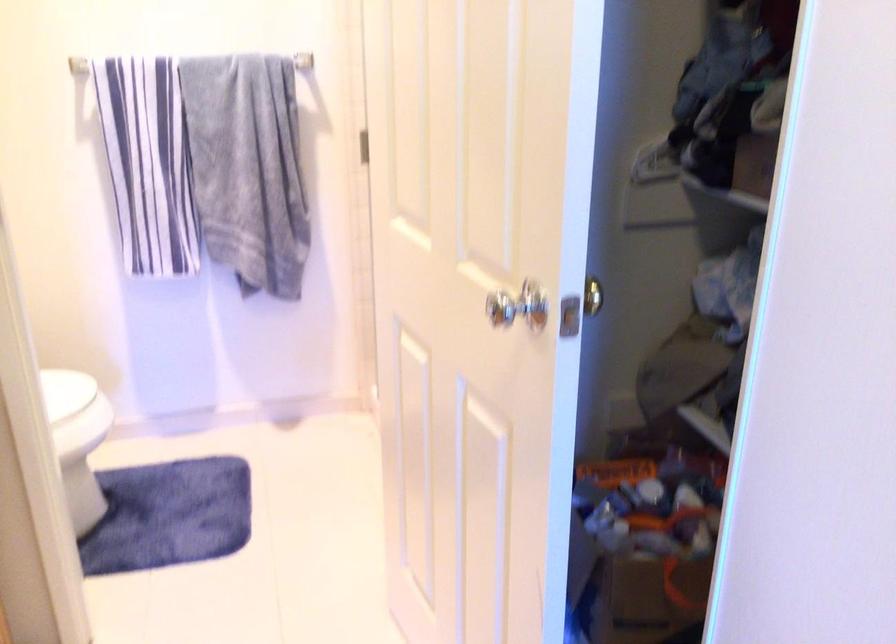
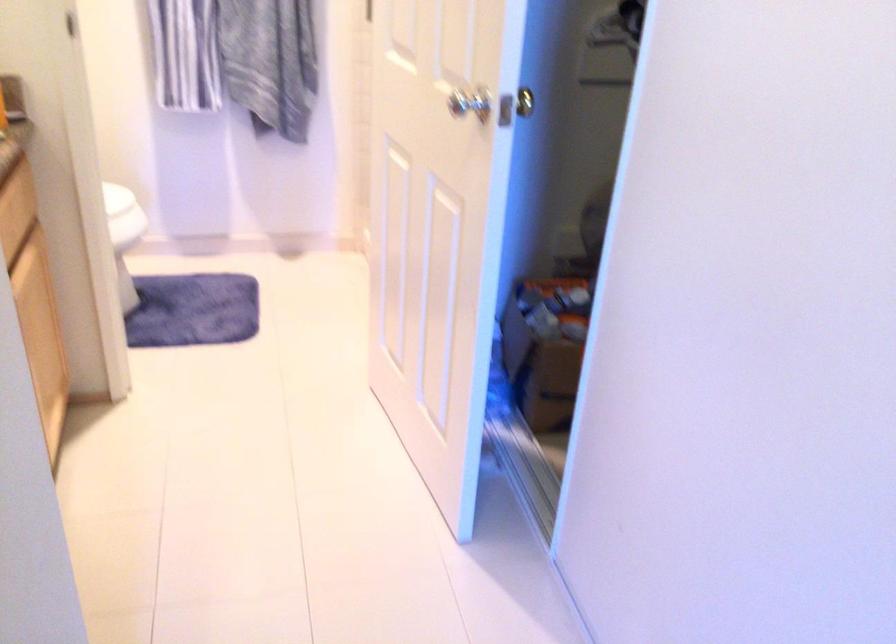
Question: In a continuous first-person perspective shot, in which direction is the camera moving?

Choices:
 (A) Left
 (B) Right
 (C) Forward
 (D) Backward

Answer: (D)